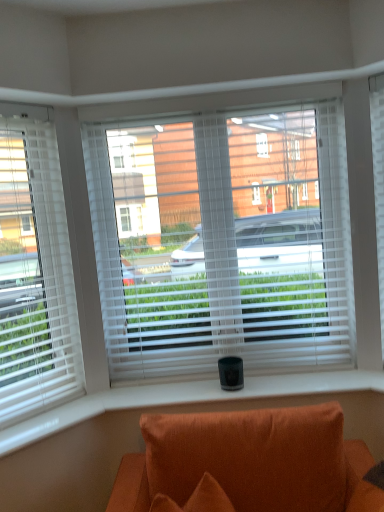
Question: In terms of height, does orange fabric couch at lower center look taller or shorter compared to white blinds at center, which is counted as the second window, starting from the left?

Choices:
 (A) short
 (B) tall

Answer: (A)

Question: Visually, is orange fabric couch at lower center positioned to the left or to the right of white blinds at center, the 1th window viewed from the right?

Choices:
 (A) left
 (B) right

Answer: (B)

Question: Which of these objects is positioned farthest from the white blinds at center, the 1th window viewed from the right?

Choices:
 (A) white textured blind at right
 (B) orange fabric couch at lower center
 (C) white blinds at left, which ranks as the first window in left-to-right order

Answer: (B)

Question: Which is nearer to the white blinds at center, the 1th window viewed from the right?

Choices:
 (A) orange fabric couch at lower center
 (B) white textured blind at right
 (C) white blinds at left, which ranks as the first window in left-to-right order

Answer: (C)